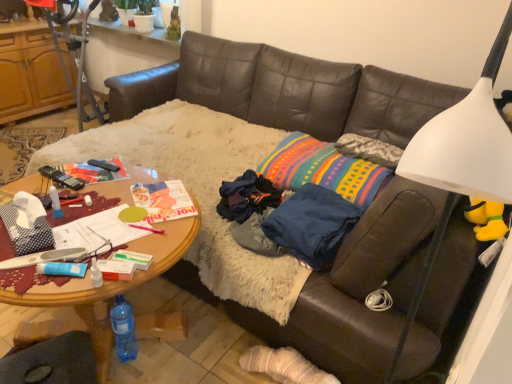
Question: Is black plastic remote control at center oriented towards multicolored woven pillow at center?

Choices:
 (A) yes
 (B) no

Answer: (B)

Question: Does black plastic remote control at center have a lesser height compared to multicolored woven pillow at center?

Choices:
 (A) no
 (B) yes

Answer: (B)

Question: Is black plastic remote control at center wider than multicolored woven pillow at center?

Choices:
 (A) no
 (B) yes

Answer: (A)

Question: From the image's perspective, is black plastic remote control at center beneath multicolored woven pillow at center?

Choices:
 (A) yes
 (B) no

Answer: (A)

Question: From the image's perspective, would you say black plastic remote control at center is positioned over multicolored woven pillow at center?

Choices:
 (A) no
 (B) yes

Answer: (A)

Question: From a real-world perspective, does black plastic remote control at center sit lower than multicolored woven pillow at center?

Choices:
 (A) no
 (B) yes

Answer: (A)

Question: Is black plastic remote control at center shorter than woodendesk at center?

Choices:
 (A) no
 (B) yes

Answer: (B)

Question: From the image's perspective, is black plastic remote control at center on woodendesk at center?

Choices:
 (A) yes
 (B) no

Answer: (A)

Question: Can you confirm if black plastic remote control at center is taller than woodendesk at center?

Choices:
 (A) no
 (B) yes

Answer: (A)

Question: Considering the relative sizes of black plastic remote control at center and woodendesk at center in the image provided, is black plastic remote control at center bigger than woodendesk at center?

Choices:
 (A) no
 (B) yes

Answer: (A)

Question: Is there a large distance between black plastic remote control at center and woodendesk at center?

Choices:
 (A) yes
 (B) no

Answer: (B)

Question: Can you confirm if black plastic remote control at center is wider than woodendesk at center?

Choices:
 (A) yes
 (B) no

Answer: (B)

Question: Could woodendesk at center be considered to be inside multicolored woven pillow at center?

Choices:
 (A) yes
 (B) no

Answer: (B)